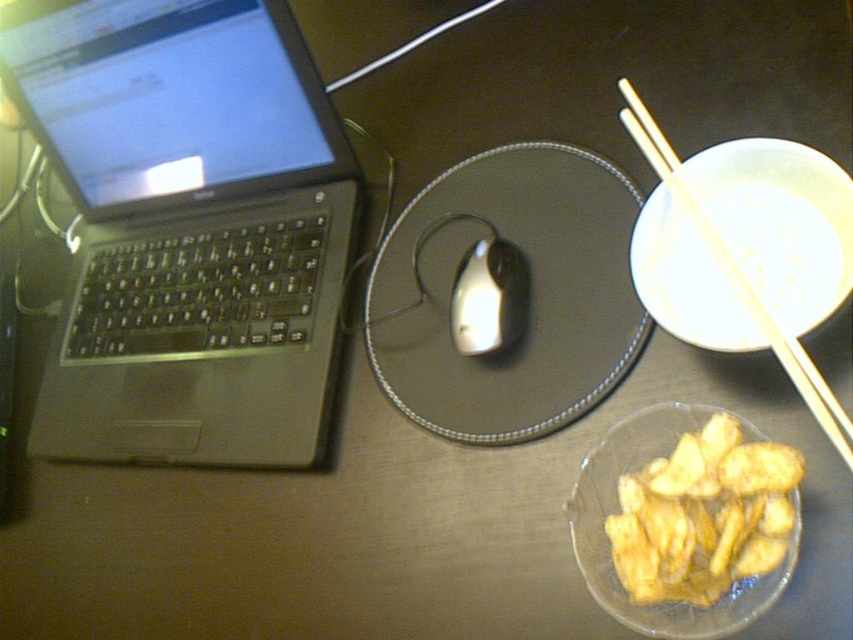
Is satin black laptop at left shorter than wooden chopsticks at upper right?

In fact, satin black laptop at left may be taller than wooden chopsticks at upper right.

This screenshot has width=853, height=640. Find the location of `satin black laptop at left`. satin black laptop at left is located at coordinates (187, 227).

Who is positioned more to the right, satin black laptop at left or glossy plastic mouse pad at center?

glossy plastic mouse pad at center

Identify the location of satin black laptop at left. The height and width of the screenshot is (640, 853). (187, 227).

Who is more distant from viewer, (250, 410) or (474, 234)?

The point (474, 234) is more distant.

Image resolution: width=853 pixels, height=640 pixels. I want to click on satin black laptop at left, so click(187, 227).

Does satin black laptop at left have a lesser width compared to golden crispy chips at lower right?

No, satin black laptop at left is not thinner than golden crispy chips at lower right.

Consider the image. Does satin black laptop at left lie behind golden crispy chips at lower right?

Yes, satin black laptop at left is further from the viewer.

Does point (254, 170) lie behind point (740, 460)?

Yes, it is behind point (740, 460).

Identify the location of satin black laptop at left. (187, 227).